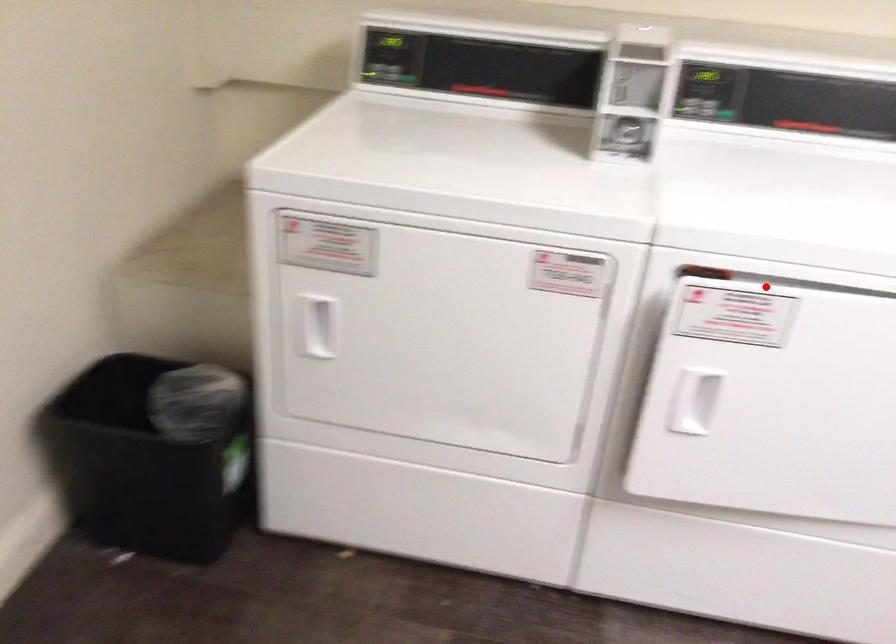
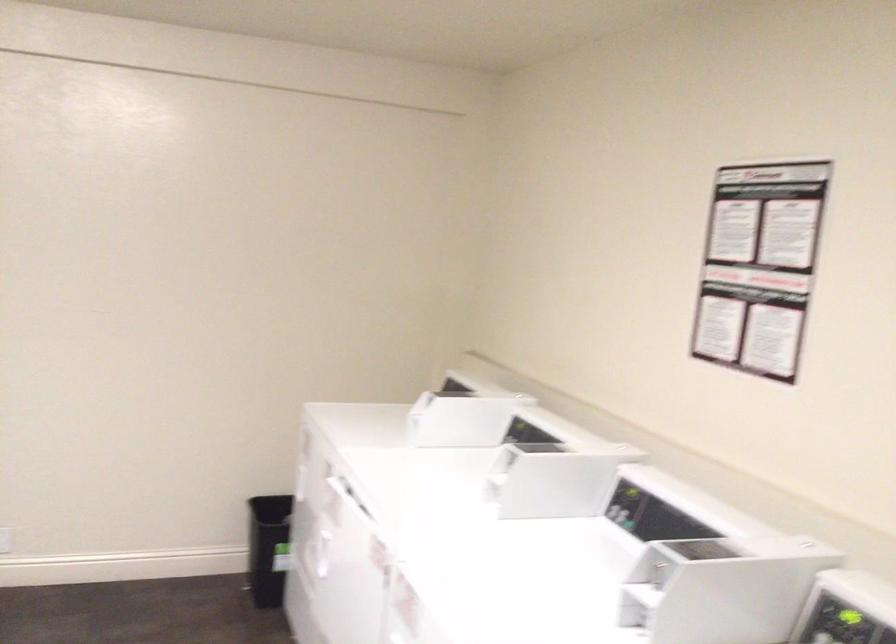
Question: I am providing you with two images of the same scene from different viewpoints. A red point is shown in image1. For the corresponding object point in image2, is it positioned nearer or farther from the camera?

Choices:
 (A) Nearer
 (B) Farther

Answer: (B)